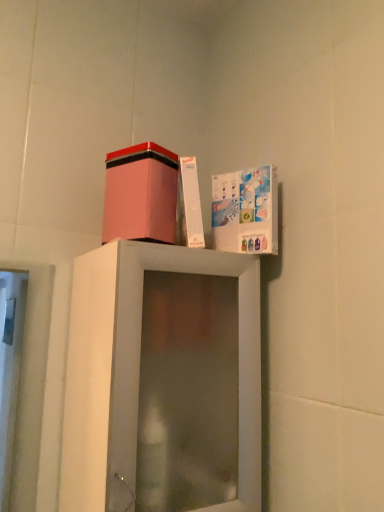
Describe the element at coordinates (245, 211) in the screenshot. I see `white cardboard box at upper right` at that location.

What is the approximate width of white cardboard box at upper right?

white cardboard box at upper right is 1.55 inches in width.

I want to click on white cardboard box at upper right, so click(x=245, y=211).

What do you see at coordinates (140, 194) in the screenshot? This screenshot has width=384, height=512. I see `pink matte cardboard box at upper center` at bounding box center [140, 194].

Find the location of a particular element. The width and height of the screenshot is (384, 512). pink matte cardboard box at upper center is located at coordinates [140, 194].

Identify the location of white cardboard box at upper right. (245, 211).

Can you confirm if pink matte cardboard box at upper center is positioned to the left of white cardboard box at upper right?

Indeed, pink matte cardboard box at upper center is positioned on the left side of white cardboard box at upper right.

Which object is further away from the camera, pink matte cardboard box at upper center or white cardboard box at upper right?

white cardboard box at upper right is further away from the camera.

Is point (121, 227) positioned behind point (236, 201)?

That is False.

From the image's perspective, is pink matte cardboard box at upper center on top of white cardboard box at upper right?

Yes.

From a real-world perspective, is pink matte cardboard box at upper center on top of white cardboard box at upper right?

Yes, from a real-world perspective, pink matte cardboard box at upper center is above white cardboard box at upper right.

Consider the image. Which object is thinner, pink matte cardboard box at upper center or white cardboard box at upper right?

Thinner between the two is white cardboard box at upper right.

Who is shorter, pink matte cardboard box at upper center or white cardboard box at upper right?

pink matte cardboard box at upper center is shorter.

Considering the relative sizes of pink matte cardboard box at upper center and white cardboard box at upper right in the image provided, is pink matte cardboard box at upper center bigger than white cardboard box at upper right?

Correct, pink matte cardboard box at upper center is larger in size than white cardboard box at upper right.

In the scene shown: Could white cardboard box at upper right be considered to be inside pink matte cardboard box at upper center?

No, white cardboard box at upper right is not inside pink matte cardboard box at upper center.

Is pink matte cardboard box at upper center positioned far away from white cardboard box at upper right?

No, pink matte cardboard box at upper center is not far from white cardboard box at upper right.

Is pink matte cardboard box at upper center facing towards white cardboard box at upper right?

No, pink matte cardboard box at upper center is not turned towards white cardboard box at upper right.

How many degrees apart are the facing directions of pink matte cardboard box at upper center and white cardboard box at upper right?

62.4 degrees separate the facing orientations of pink matte cardboard box at upper center and white cardboard box at upper right.

Locate an element on the screen. This screenshot has width=384, height=512. cabinet below the pink matte cardboard box at upper center (from the image's perspective) is located at coordinates (x=245, y=211).

Which is more to the left, white cardboard box at upper right or pink matte cardboard box at upper center?

pink matte cardboard box at upper center is more to the left.

Between white cardboard box at upper right and pink matte cardboard box at upper center, which one is positioned behind?

Positioned behind is white cardboard box at upper right.

Which is in front, point (250, 241) or point (173, 234)?

The point (173, 234) is in front.

From the image's perspective, which one is positioned lower, white cardboard box at upper right or pink matte cardboard box at upper center?

white cardboard box at upper right, from the image's perspective.

From a real-world perspective, is white cardboard box at upper right physically below pink matte cardboard box at upper center?

Yes, from a real-world perspective, white cardboard box at upper right is beneath pink matte cardboard box at upper center.

Is white cardboard box at upper right wider than pink matte cardboard box at upper center?

In fact, white cardboard box at upper right might be narrower than pink matte cardboard box at upper center.

In terms of height, does white cardboard box at upper right look taller or shorter compared to pink matte cardboard box at upper center?

Clearly, white cardboard box at upper right is taller compared to pink matte cardboard box at upper center.

In the scene shown: Considering the relative sizes of white cardboard box at upper right and pink matte cardboard box at upper center in the image provided, is white cardboard box at upper right smaller than pink matte cardboard box at upper center?

Indeed, white cardboard box at upper right has a smaller size compared to pink matte cardboard box at upper center.

Would you say white cardboard box at upper right contains pink matte cardboard box at upper center?

No, white cardboard box at upper right does not contain pink matte cardboard box at upper center.

Is white cardboard box at upper right directly adjacent to pink matte cardboard box at upper center?

No, white cardboard box at upper right is not with pink matte cardboard box at upper center.

Looking at this image, is white cardboard box at upper right positioned with its back to pink matte cardboard box at upper center?

No.

The height and width of the screenshot is (512, 384). I want to click on cardboard box on the left of white cardboard box at upper right, so [140, 194].

Where is `cardboard box that is in front of the white cardboard box at upper right`? The image size is (384, 512). cardboard box that is in front of the white cardboard box at upper right is located at coordinates (140, 194).

Find the location of a particular element. This screenshot has height=512, width=384. cardboard box positioned vertically above the white cardboard box at upper right (from a real-world perspective) is located at coordinates (140, 194).